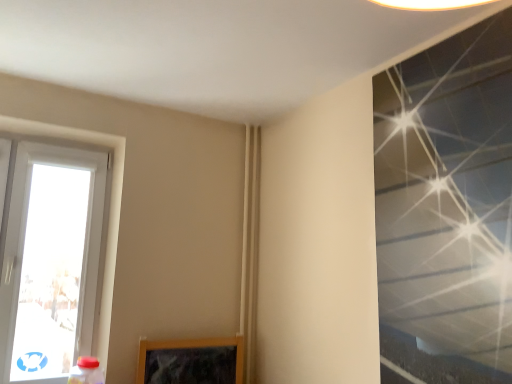
Question: Considering the positions of transparent glass window at upper right, the 2th window from the left, and white plastic window at left, the 1th window from the left, in the image, is transparent glass window at upper right, the 2th window from the left, wider or thinner than white plastic window at left, the 1th window from the left,?

Choices:
 (A) thin
 (B) wide

Answer: (A)

Question: Is point (496, 344) positioned closer to the camera than point (24, 152)?

Choices:
 (A) closer
 (B) farther

Answer: (A)

Question: In terms of height, does transparent glass window at upper right, which ranks as the 2th window in back-to-front order, look taller or shorter compared to white plastic window at left, the 1th window from the left?

Choices:
 (A) short
 (B) tall

Answer: (B)

Question: From their relative heights in the image, would you say white plastic window at left, the 1th window from the left, is taller or shorter than transparent glass window at upper right, which ranks as the 2th window in back-to-front order?

Choices:
 (A) short
 (B) tall

Answer: (A)

Question: Considering the relative positions of white plastic window at left, the second window in the right-to-left sequence, and transparent glass window at upper right, which ranks as the 2th window in back-to-front order, in the image provided, is white plastic window at left, the second window in the right-to-left sequence, to the left or to the right of transparent glass window at upper right, which ranks as the 2th window in back-to-front order,?

Choices:
 (A) right
 (B) left

Answer: (B)

Question: From a real-world perspective, is white plastic window at left, the 1th window from the left, above or below transparent glass window at upper right, the first window viewed from the right?

Choices:
 (A) above
 (B) below

Answer: (B)

Question: From the image's perspective, relative to transparent glass window at upper right, which ranks as the 2th window in back-to-front order, is white plastic window at left, which appears as the first window when viewed from the back, above or below?

Choices:
 (A) above
 (B) below

Answer: (B)